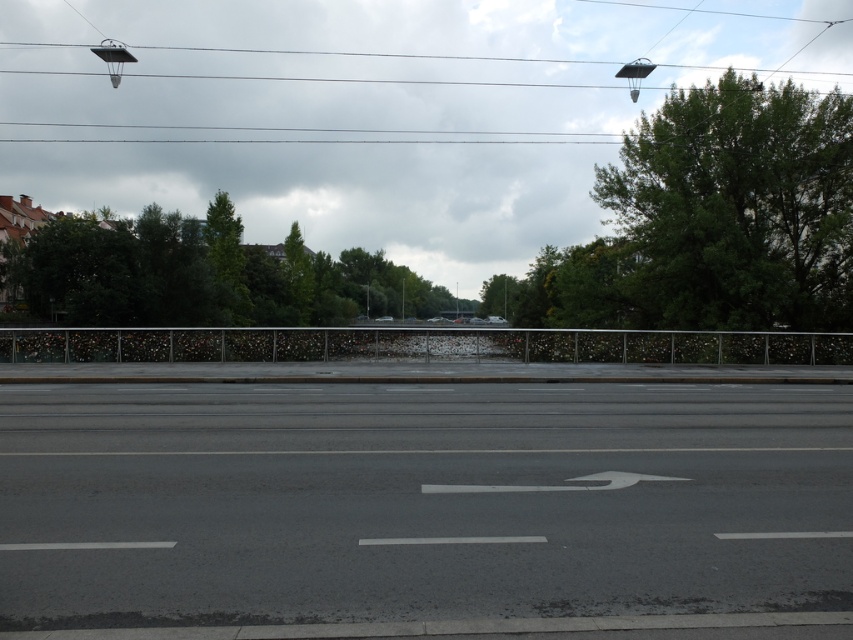
Question: Which object is closer to the camera taking this photo?

Choices:
 (A) green leafy tree at upper center
 (B) metallic wire at upper center

Answer: (A)

Question: Which object is closer to the camera taking this photo?

Choices:
 (A) metallic wire at upper center
 (B) green leafy tree at upper right
 (C) green leafy tree at upper center

Answer: (B)

Question: Can you confirm if metallic wire at upper center is smaller than green leafy tree at upper center?

Choices:
 (A) no
 (B) yes

Answer: (A)

Question: Which of these objects is positioned farthest from the green leafy tree at upper center?

Choices:
 (A) metallic wire at upper center
 (B) green leafy tree at upper right

Answer: (A)

Question: Is green leafy tree at upper right thinner than green leafy tree at upper center?

Choices:
 (A) yes
 (B) no

Answer: (B)

Question: Does metallic wire at upper center appear on the left side of green leafy tree at upper center?

Choices:
 (A) no
 (B) yes

Answer: (A)